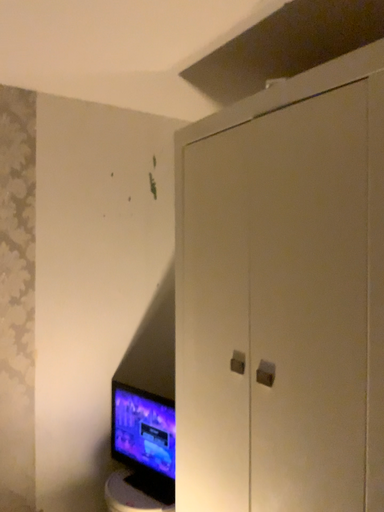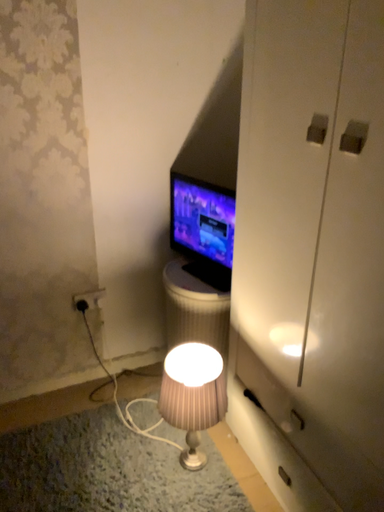
Question: How did the camera likely rotate when shooting the video?

Choices:
 (A) rotated right
 (B) rotated left

Answer: (B)